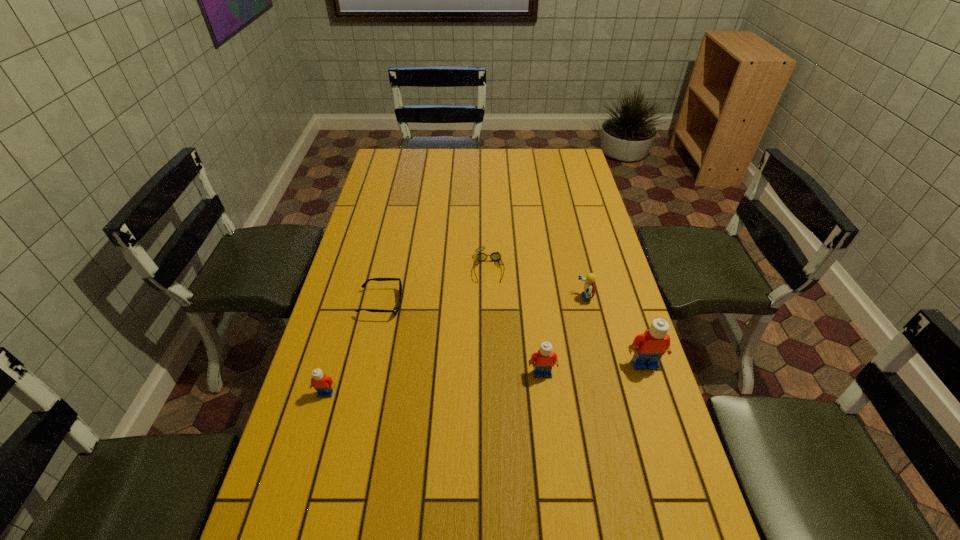
If equal spacing is the goal by inserting an additional Lego among them, please point out a vacant space for this new Lego. Please provide its 2D coordinates. Your answer should be formatted as a tuple, i.e. [(x, y)], where the tuple contains the x and y coordinates of a point satisfying the conditions above.

[(436, 383)]